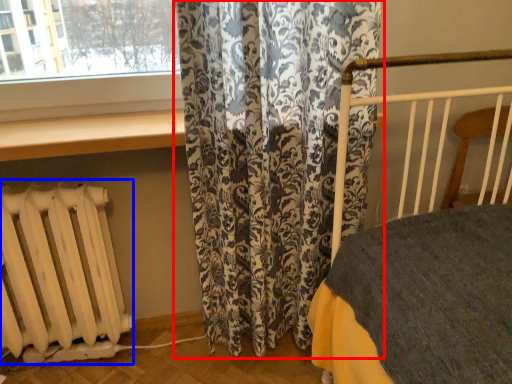
Question: Which object appears closest to the camera in this image, curtain (highlighted by a red box) or radiator (highlighted by a blue box)?

Choices:
 (A) curtain
 (B) radiator

Answer: (A)